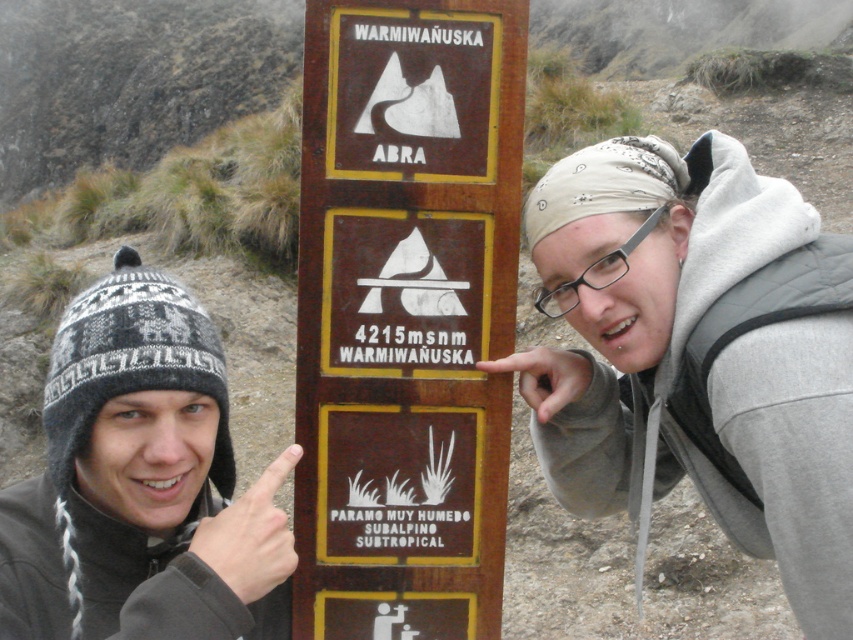
Question: Which point is closer to the camera?

Choices:
 (A) black plastic glasses at upper center
 (B) knitted wool hat at center
 (C) brown wooden sign at center
 (D) gray hoodie at center

Answer: (B)

Question: Which point is farther to the camera?

Choices:
 (A) brown wooden sign at center
 (B) gray hoodie at center

Answer: (A)

Question: Which point appears farthest from the camera in this image?

Choices:
 (A) (590, 280)
 (B) (421, 360)
 (C) (834, 554)
 (D) (138, 262)

Answer: (B)

Question: From the image, what is the correct spatial relationship of knitted wool hat at center in relation to black plastic glasses at upper center?

Choices:
 (A) below
 (B) above

Answer: (A)

Question: Does brown wooden sign at center have a larger size compared to knitted wool hat at center?

Choices:
 (A) no
 (B) yes

Answer: (A)

Question: From the image, what is the correct spatial relationship of brown wooden sign at center in relation to gray hoodie at center?

Choices:
 (A) left
 (B) right

Answer: (A)